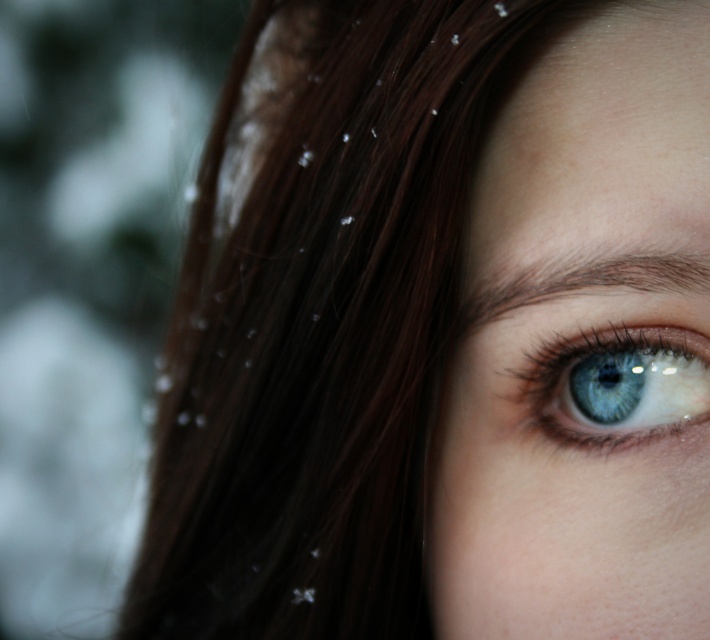
Can you confirm if matte brown hair at upper right is bigger than blue glossy eye at center?

Yes.

Does matte brown hair at upper right appear on the left side of blue glossy eye at center?

Indeed, matte brown hair at upper right is positioned on the left side of blue glossy eye at center.

The image size is (710, 640). What are the coordinates of `matte brown hair at upper right` in the screenshot? It's located at (581, 346).

Identify the location of matte brown hair at upper right. [x=581, y=346].